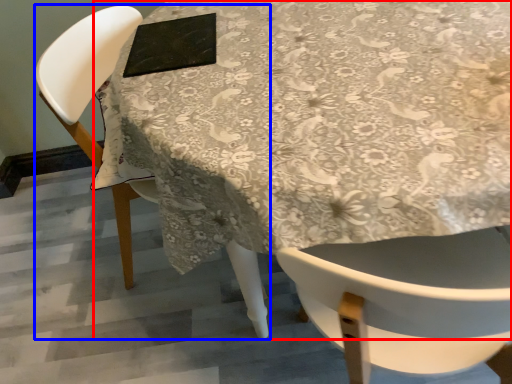
Question: Which of the following is the closest to the observer, table (highlighted by a red box) or chair (highlighted by a blue box)?

Choices:
 (A) table
 (B) chair

Answer: (A)